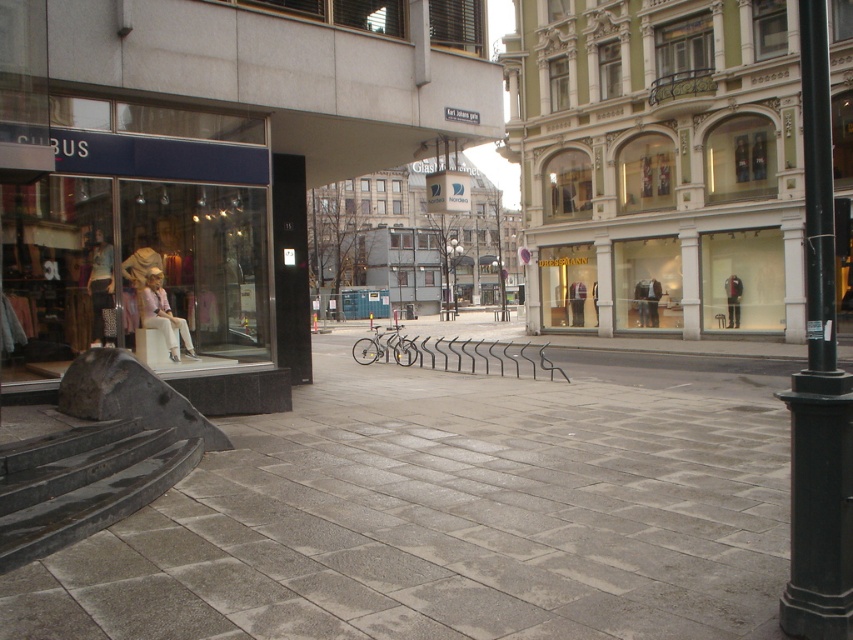
Question: Which of the following is the farthest from the observer?

Choices:
 (A) (445, 252)
 (B) (612, 404)
 (C) (503, 307)
 (D) (770, 77)

Answer: (A)

Question: Is the position of black metal pole at right more distant than that of black metal lamp post at center?

Choices:
 (A) yes
 (B) no

Answer: (B)

Question: Is the position of gray concrete pavement at center more distant than that of matte glass storefront at center?

Choices:
 (A) yes
 (B) no

Answer: (A)

Question: Is the position of black metal pole at right more distant than that of wooden park bench at center?

Choices:
 (A) yes
 (B) no

Answer: (B)

Question: Which object is positioned closest to the wooden park bench at center?

Choices:
 (A) matte glass storefront at center
 (B) black metal pole at center
 (C) black metal lamp post at center

Answer: (B)

Question: Which point is closer to the camera?

Choices:
 (A) (500, 288)
 (B) (498, 310)

Answer: (A)